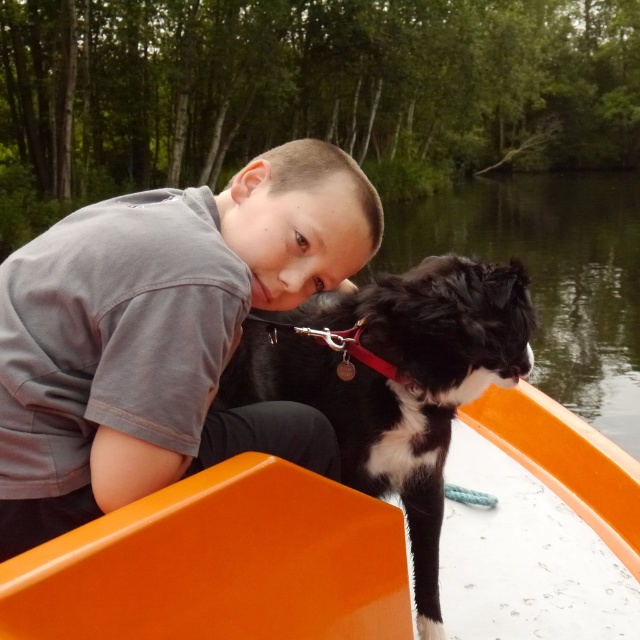
Question: Estimate the real-world distances between objects in this image. Which object is closer to the orange plastic boat at center?

Choices:
 (A) black and white fur dog at center
 (B) gray cotton shirt at upper left

Answer: (A)

Question: Does gray cotton shirt at upper left have a lesser width compared to orange plastic boat at center?

Choices:
 (A) no
 (B) yes

Answer: (A)

Question: Is gray cotton shirt at upper left below black and white fur dog at center?

Choices:
 (A) no
 (B) yes

Answer: (A)

Question: Which point is closer to the camera?

Choices:
 (A) (339, 516)
 (B) (198, 355)
 (C) (449, 292)

Answer: (B)

Question: Which point is farther from the camera taking this photo?

Choices:
 (A) (627, 499)
 (B) (426, 326)

Answer: (A)

Question: Can you confirm if orange plastic boat at center is positioned to the right of black and white fur dog at center?

Choices:
 (A) yes
 (B) no

Answer: (A)